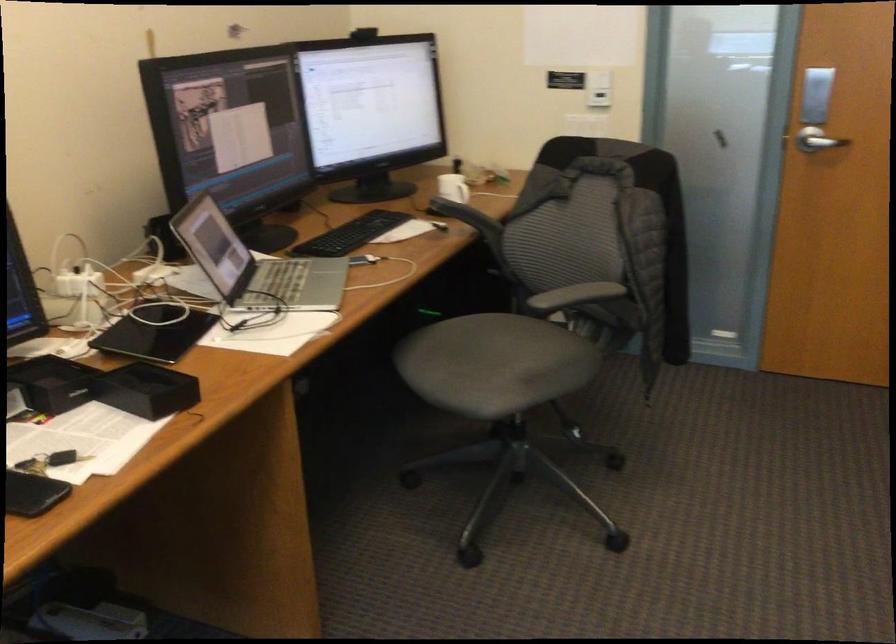
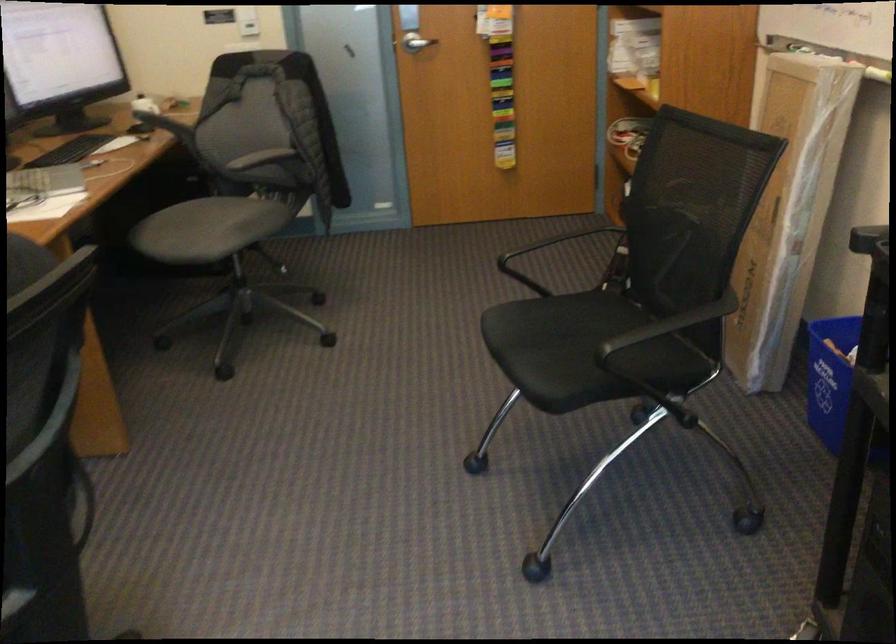
The point at (486,366) is marked in the first image. Where is the corresponding point in the second image?

(207, 229)